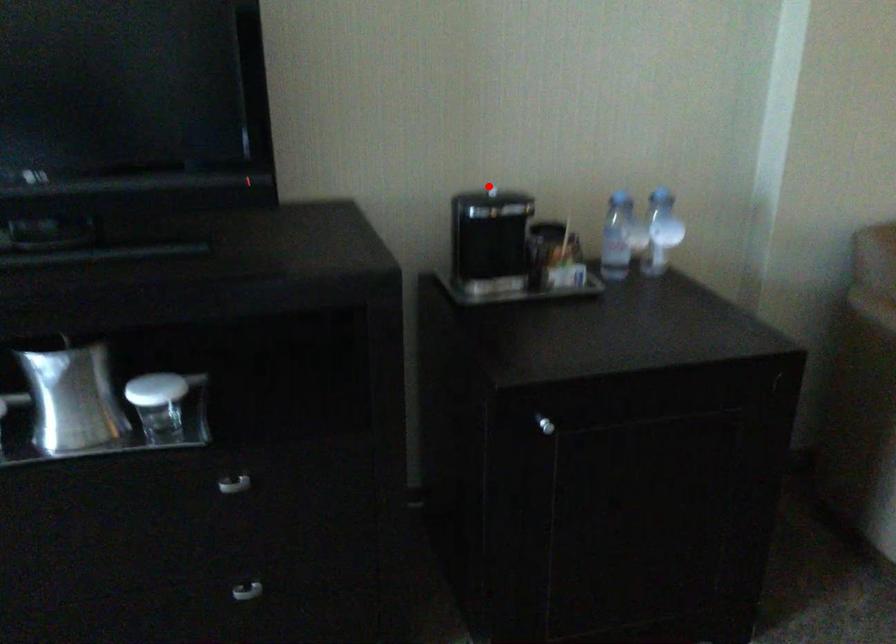
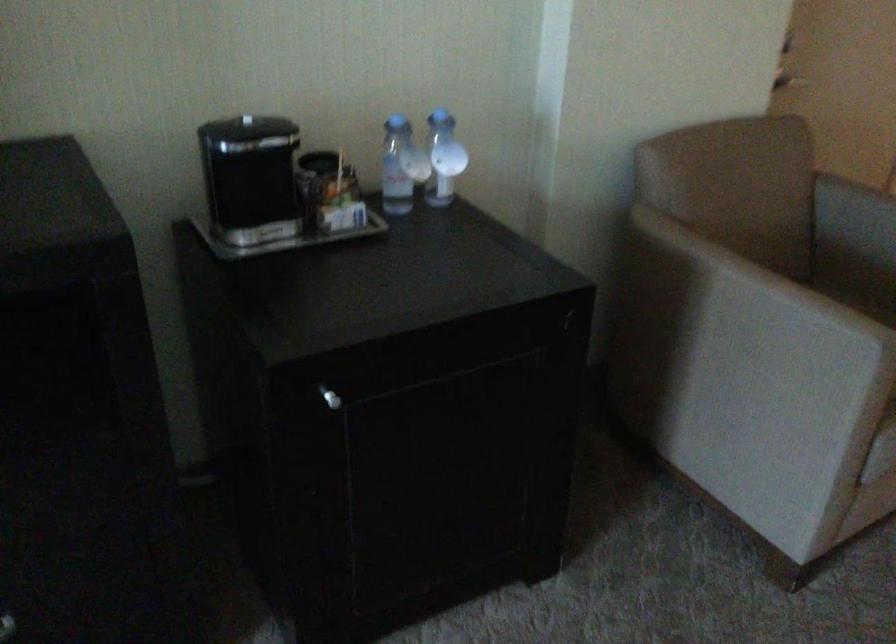
The point at the highlighted location is marked in the first image. Where is the corresponding point in the second image?

(246, 120)